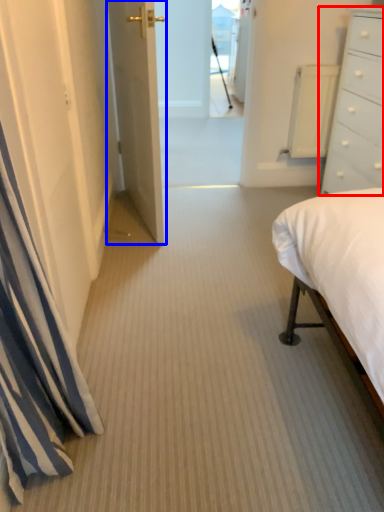
Question: Among these objects, which one is nearest to the camera, chest of drawers (highlighted by a red box) or door (highlighted by a blue box)?

Choices:
 (A) chest of drawers
 (B) door

Answer: (A)